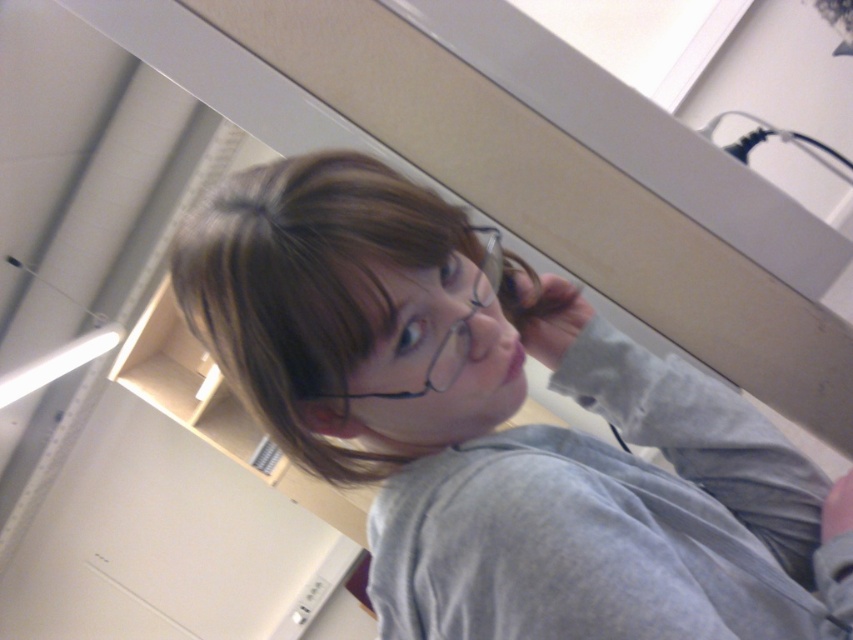
You are standing in the room and want to determine which of the two points, point (312, 276) or point (480, 278), is nearer to you. Based on the scene description, which point is closer?

Point (312, 276) is closer to the camera than point (480, 278), so it is the nearer point.

Based on the photo, you are a photographer setting up for a portrait. You need to ensure that both the brown matte hair at upper center and the clear plastic glasses at center are in focus. Based on their positions, which object should you focus on first to ensure both are sharp?

You should focus on the brown matte hair at upper center first because it is closer to the viewer than the clear plastic glasses at center. By focusing on the closer object, the depth of field will naturally include the farther object in focus as well.

You are a fashion designer analyzing a photo of a person wearing a gray matte shirt at center and clear plastic glasses at center. Which item is positioned higher on the person?

The gray matte shirt at center is taller than clear plastic glasses at center, so the gray matte shirt at center is positioned higher on the person.